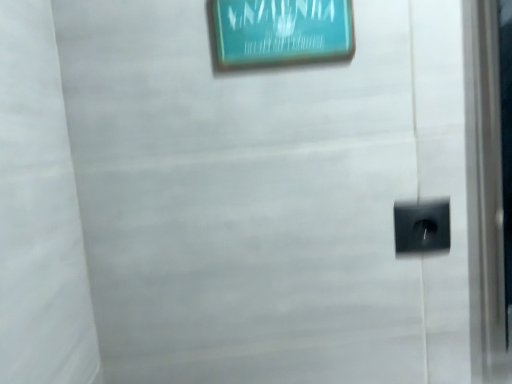
Question: Considering the positions of point (282, 59) and point (408, 231), is point (282, 59) closer or farther from the camera than point (408, 231)?

Choices:
 (A) closer
 (B) farther

Answer: (A)

Question: Is teal glossy picture frame at upper center taller or shorter than black plastic electric outlet at lower right?

Choices:
 (A) tall
 (B) short

Answer: (A)

Question: Looking at their shapes, would you say teal glossy picture frame at upper center is wider or thinner than black plastic electric outlet at lower right?

Choices:
 (A) thin
 (B) wide

Answer: (B)

Question: From their relative heights in the image, would you say black plastic electric outlet at lower right is taller or shorter than teal glossy picture frame at upper center?

Choices:
 (A) tall
 (B) short

Answer: (B)

Question: Would you say black plastic electric outlet at lower right is to the left or to the right of teal glossy picture frame at upper center in the picture?

Choices:
 (A) right
 (B) left

Answer: (A)

Question: From the image's perspective, is black plastic electric outlet at lower right located above or below teal glossy picture frame at upper center?

Choices:
 (A) below
 (B) above

Answer: (A)

Question: Relative to teal glossy picture frame at upper center, is black plastic electric outlet at lower right in front or behind?

Choices:
 (A) front
 (B) behind

Answer: (B)